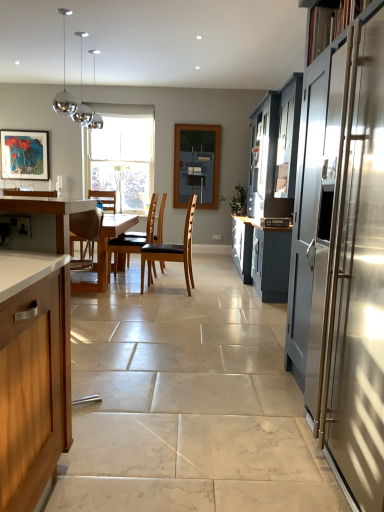
Question: Is point (215, 128) closer or farther from the camera than point (148, 252)?

Choices:
 (A) closer
 (B) farther

Answer: (B)

Question: From the image's perspective, is matte glass window screen at center above or below brown leather chair at center, which is counted as the first chair, starting from the front?

Choices:
 (A) above
 (B) below

Answer: (A)

Question: Which of these objects is positioned closest to the brown leather chair at center, which is counted as the first chair, starting from the front?

Choices:
 (A) satin silver microwave at center
 (B) wooden countertop at left, which is counted as the 2th cabinetry, starting from the front
 (C) matte glass window screen at center
 (D) matte wooden picture frame at upper left
 (E) stainless steel cabinet at right, which is counted as the 2th cabinetry, starting from the right

Answer: (A)

Question: Which is farther from the stainless steel cabinet at right, which is counted as the 1th cabinetry, starting from the front?

Choices:
 (A) wooden countertop at left, which is counted as the 1th cabinetry, starting from the left
 (B) matte wooden picture frame at upper left
 (C) clear glass window at center
 (D) matte blue cabinet at right, which appears as the third cabinetry when viewed from the left
 (E) brown leather chair at center, which is the 1th chair from left to right

Answer: (B)